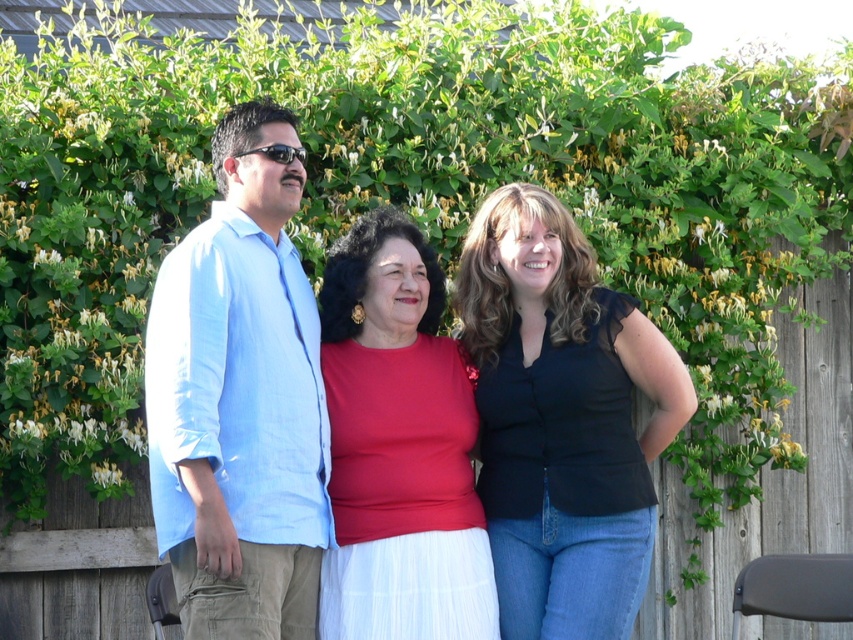
Who is positioned more to the left, light blue cotton shirt at left or black matte top at center?

From the viewer's perspective, light blue cotton shirt at left appears more on the left side.

Which of these two, light blue cotton shirt at left or black matte top at center, stands taller?

light blue cotton shirt at left is taller.

Find the location of a particular element. This screenshot has height=640, width=853. light blue cotton shirt at left is located at coordinates (241, 397).

Between light blue shirt at center and light blue cotton shirt at left, which one is positioned lower?

light blue cotton shirt at left is below.

Is point (225, 483) positioned behind point (207, 428)?

Yes, it is behind point (207, 428).

Find the location of `light blue shirt at center`. light blue shirt at center is located at coordinates (239, 358).

Is point (199, 256) in front of point (445, 614)?

Yes.

Can you confirm if light blue shirt at center is taller than matte red blouse at center?

Yes, light blue shirt at center is taller than matte red blouse at center.

Between point (187, 253) and point (424, 470), which one is positioned in front?

Point (187, 253) is in front.

The width and height of the screenshot is (853, 640). In order to click on light blue shirt at center in this screenshot , I will do `click(239, 358)`.